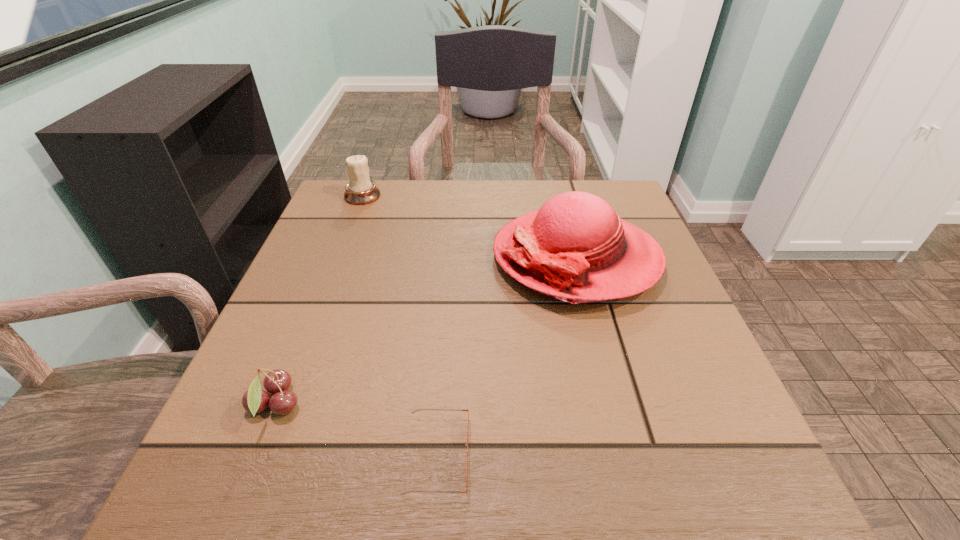
This screenshot has height=540, width=960. In order to click on hat in this screenshot , I will do `click(575, 248)`.

Find the location of a particular element. the tallest object is located at coordinates (x=575, y=248).

Image resolution: width=960 pixels, height=540 pixels. Find the location of `candle holder`. candle holder is located at coordinates (360, 190).

Identify the location of the farthest object. (360, 190).

I want to click on cherry, so click(255, 400).

Find the location of a particular element. This screenshot has width=960, height=540. sunglasses is located at coordinates [x=404, y=493].

You are a GUI agent. You are given a task and a screenshot of the screen. Output one action in this format:
    pyautogui.click(x=<x>, y=<y>)
    Task: Click on the second object from right to left
    This screenshot has height=540, width=960.
    Given the screenshot: What is the action you would take?
    pyautogui.click(x=404, y=493)

Where is `vacant region located 0.390m at the front of the tallest object with a bow`? vacant region located 0.390m at the front of the tallest object with a bow is located at coordinates (311, 257).

At what (x,y) coordinates should I click in order to perform the action: click on vacant space situated at the front of the tallest object with a bow. Please return your answer as a coordinate pair (x, y). The height and width of the screenshot is (540, 960). Looking at the image, I should click on (335, 257).

You are a GUI agent. You are given a task and a screenshot of the screen. Output one action in this format:
    pyautogui.click(x=<x>, y=<y>)
    Task: Click on the free space located at the front of the tallest object with a bow
    The height and width of the screenshot is (540, 960).
    Given the screenshot: What is the action you would take?
    pyautogui.click(x=372, y=257)